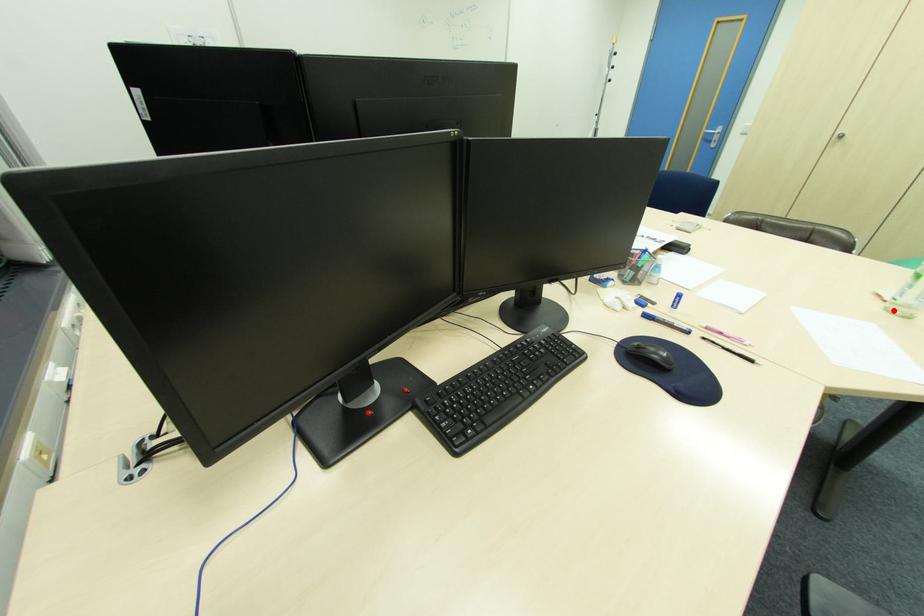
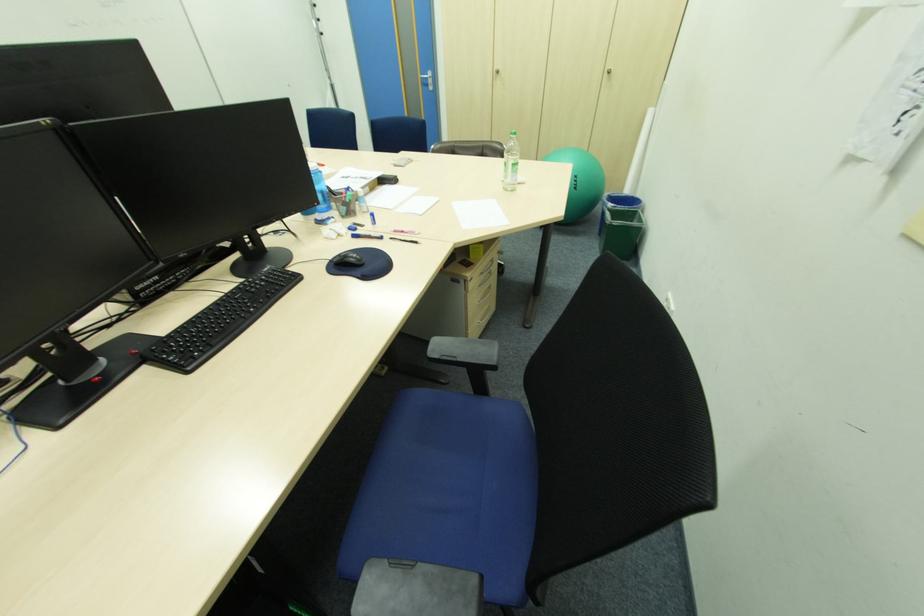
Question: I am providing you with two images of the same scene from different viewpoints. In image1, a red point is highlighted. Considering the same 3D point in image2, which of the following is correct?

Choices:
 (A) It is closer
 (B) It is farther

Answer: (A)